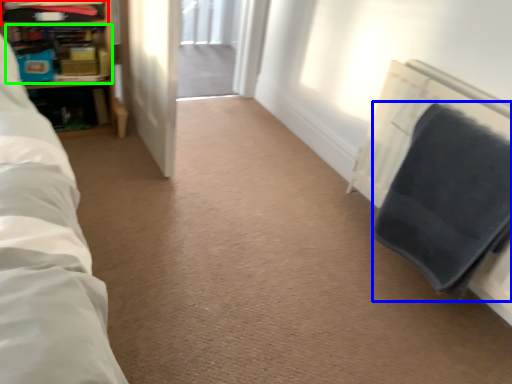
Question: Which object is positioned farthest from shelf (highlighted by a red box)? Select from blanket (highlighted by a blue box) and shelf (highlighted by a green box).

Choices:
 (A) blanket
 (B) shelf

Answer: (A)